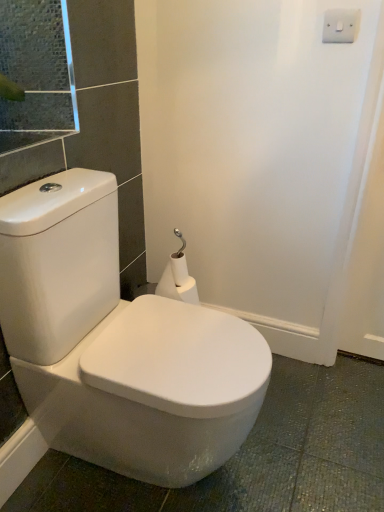
Question: Is the depth of white glossy toilet at center less than that of white matte toilet paper at center?

Choices:
 (A) no
 (B) yes

Answer: (B)

Question: From a real-world perspective, is white glossy toilet at center over white matte toilet paper at center?

Choices:
 (A) no
 (B) yes

Answer: (A)

Question: Could white matte toilet paper at center be considered to be inside white glossy toilet at center?

Choices:
 (A) yes
 (B) no

Answer: (B)

Question: Is white glossy toilet at center smaller than white matte toilet paper at center?

Choices:
 (A) no
 (B) yes

Answer: (A)

Question: Would you say white glossy toilet at center is a long distance from white matte toilet paper at center?

Choices:
 (A) yes
 (B) no

Answer: (B)

Question: From a real-world perspective, is white glossy toilet at center positioned under white matte toilet paper at center based on gravity?

Choices:
 (A) no
 (B) yes

Answer: (B)

Question: Does white matte toilet paper at center have a greater width compared to white glossy toilet at center?

Choices:
 (A) yes
 (B) no

Answer: (B)

Question: Considering the relative positions of white matte toilet paper at center and white glossy toilet at center in the image provided, is white matte toilet paper at center to the left of white glossy toilet at center from the viewer's perspective?

Choices:
 (A) yes
 (B) no

Answer: (B)

Question: Does white matte toilet paper at center have a lesser width compared to white glossy toilet at center?

Choices:
 (A) no
 (B) yes

Answer: (B)

Question: From a real-world perspective, is white matte toilet paper at center physically below white glossy toilet at center?

Choices:
 (A) yes
 (B) no

Answer: (B)

Question: Could you tell me if white matte toilet paper at center is turned towards white glossy toilet at center?

Choices:
 (A) yes
 (B) no

Answer: (A)

Question: Would you say white matte toilet paper at center is a long distance from white glossy toilet at center?

Choices:
 (A) no
 (B) yes

Answer: (A)

Question: Does white matte toilet paper at center have a greater width compared to white plastic/light switch at upper right?

Choices:
 (A) yes
 (B) no

Answer: (A)